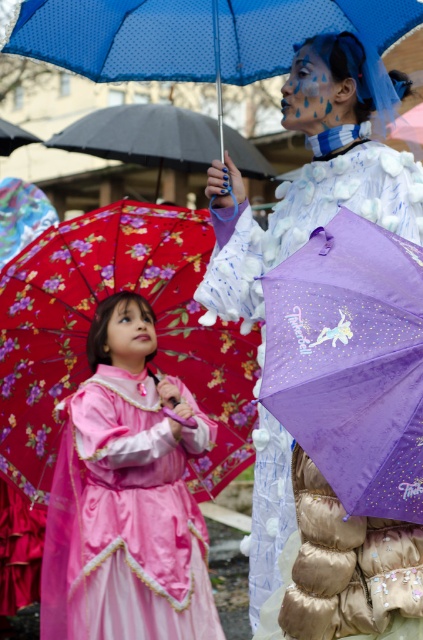
You are a photographer setting up for a photoshoot. You need to position a camera so that both the purple fabric umbrella at center and the floral fabric umbrella at center are fully visible in the frame. Considering their heights, which umbrella should be placed closer to the camera to ensure both are fully captured without any part being cut off?

The purple fabric umbrella at center is taller than the floral fabric umbrella at center. To ensure both are fully visible, the taller purple fabric umbrella at center should be placed closer to the camera so that its full height can be captured without obstruction, while the shorter floral fabric umbrella at center can be positioned slightly further back.